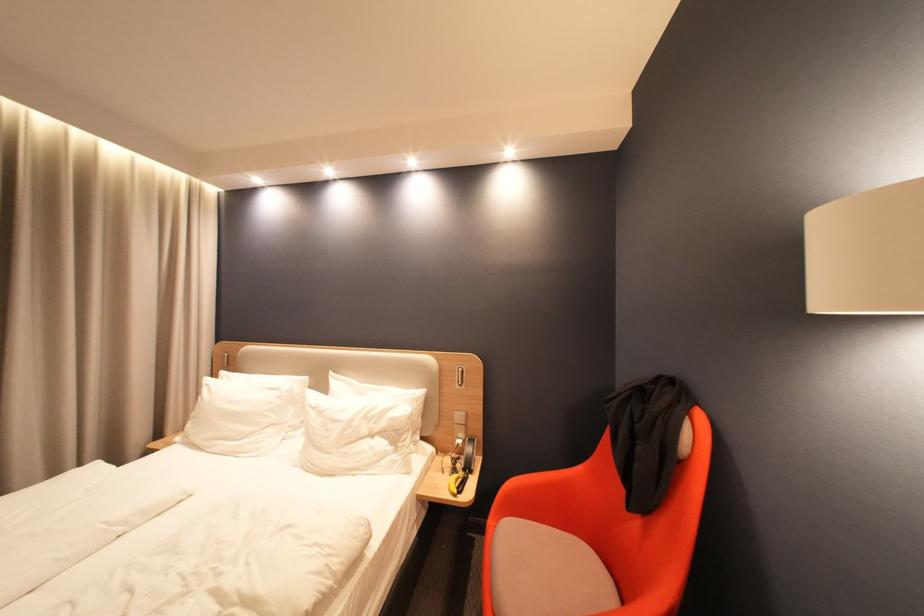
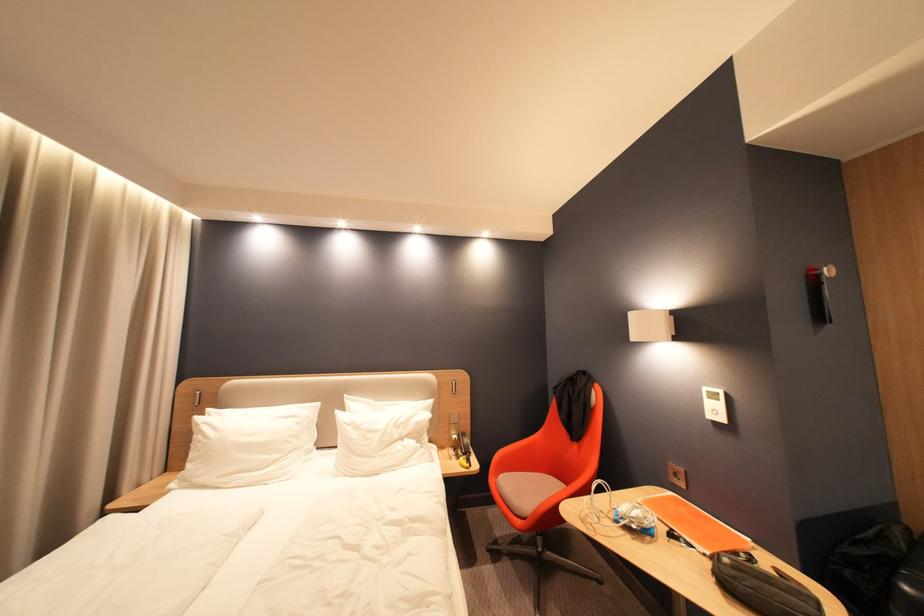
In the second image, find the point that corresponds to point 216,386 in the first image.

(213, 424)